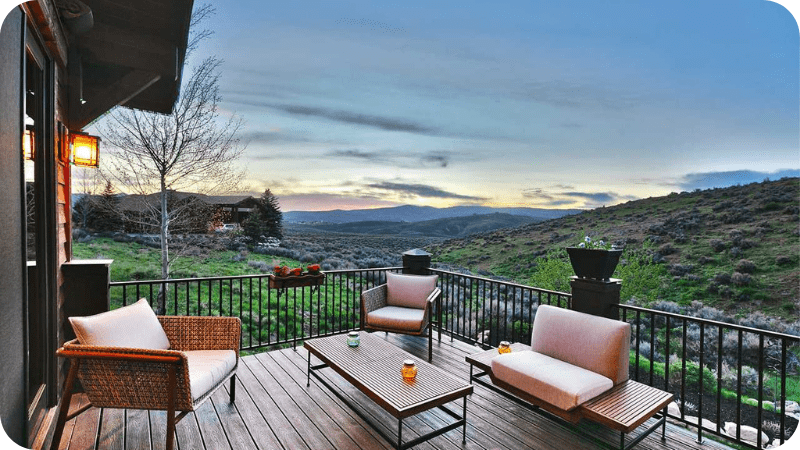
Find the location of a particular element. This screenshot has width=800, height=450. door is located at coordinates (30, 221).